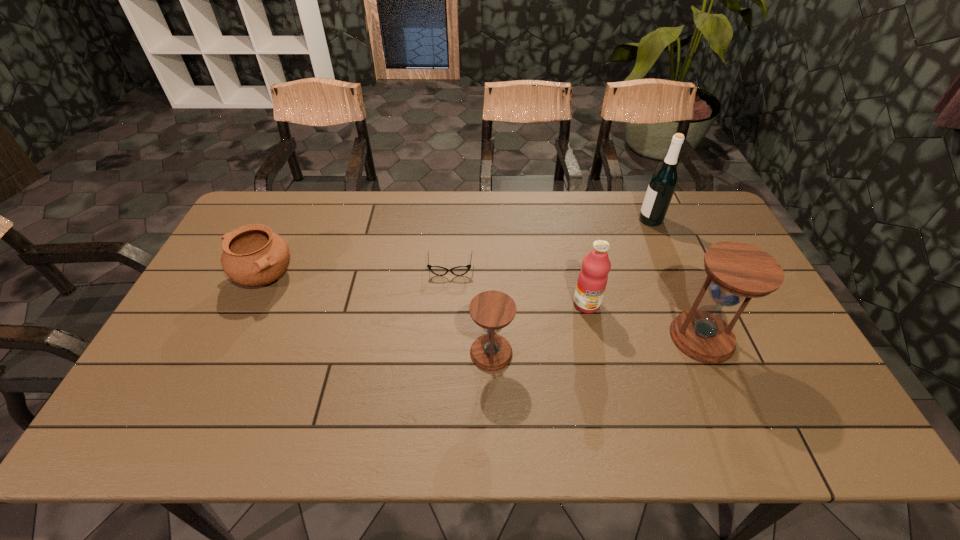
The image size is (960, 540). I want to click on the shorter hourglass, so click(492, 310).

Where is `the taller hourglass`? Image resolution: width=960 pixels, height=540 pixels. the taller hourglass is located at coordinates (735, 271).

The width and height of the screenshot is (960, 540). What are the coordinates of `the right hourglass` in the screenshot? It's located at (735, 271).

The width and height of the screenshot is (960, 540). Identify the location of the farthest object. (663, 182).

Locate an element on the screen. wine bottle is located at coordinates click(663, 182).

You are a GUI agent. You are given a task and a screenshot of the screen. Output one action in this format:
    pyautogui.click(x=<x>, y=<y>)
    Task: Click on the shortest object
    This screenshot has width=960, height=540.
    Given the screenshot: What is the action you would take?
    pyautogui.click(x=437, y=270)

Image resolution: width=960 pixels, height=540 pixels. Find the location of `pottery`. pottery is located at coordinates (253, 255).

Where is `the fifth tallest object`? This screenshot has height=540, width=960. the fifth tallest object is located at coordinates (253, 255).

The width and height of the screenshot is (960, 540). What are the coordinates of `the third object from right to left` in the screenshot? It's located at (592, 280).

You are a GUI agent. You are given a task and a screenshot of the screen. Output one action in this format:
    pyautogui.click(x=<x>, y=<y>)
    Task: Click on the third tallest object
    The height and width of the screenshot is (540, 960).
    Given the screenshot: What is the action you would take?
    pyautogui.click(x=592, y=280)